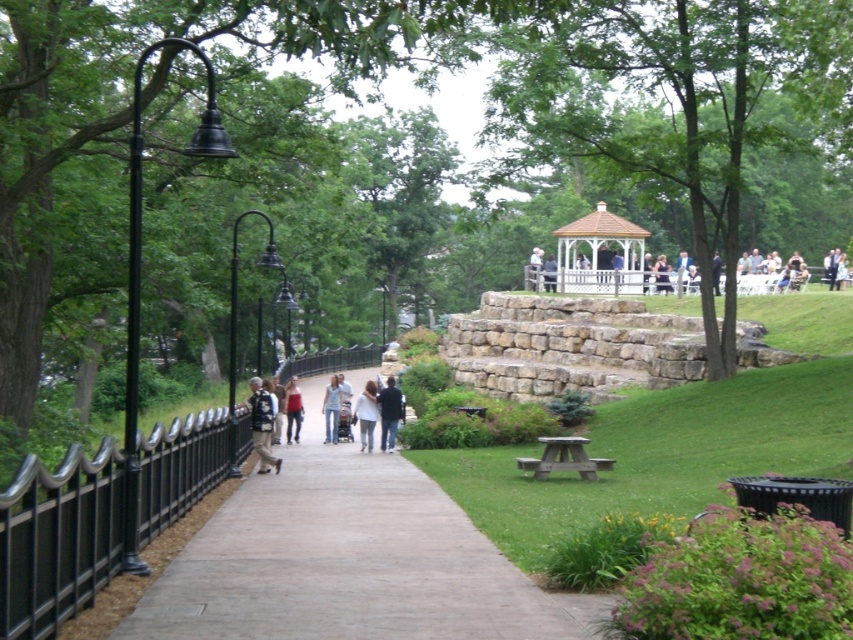
Question: Does denim jacket at center have a smaller size compared to light beige fabric jacket at center?

Choices:
 (A) yes
 (B) no

Answer: (B)

Question: Is green leafy tree at upper center wider than white wooden gazebo at center?

Choices:
 (A) yes
 (B) no

Answer: (A)

Question: Which object appears closest to the camera in this image?

Choices:
 (A) matte red shirt at center
 (B) light beige fabric jacket at center
 (C) denim jeans at center

Answer: (B)

Question: Considering the real-world distances, which object is closest to the dark blue jeans at center?

Choices:
 (A) denim jeans at center
 (B) denim jacket at center
 (C) light beige fabric jacket at center
 (D) wooden picnic table at center

Answer: (C)

Question: Estimate the real-world distances between objects in this image. Which object is farther from the denim jacket at center?

Choices:
 (A) concrete sidewalk at center
 (B) denim jeans at center

Answer: (B)

Question: Observing the image, what is the correct spatial positioning of wooden picnic table at center in reference to light beige fabric jacket at center?

Choices:
 (A) below
 (B) above

Answer: (B)